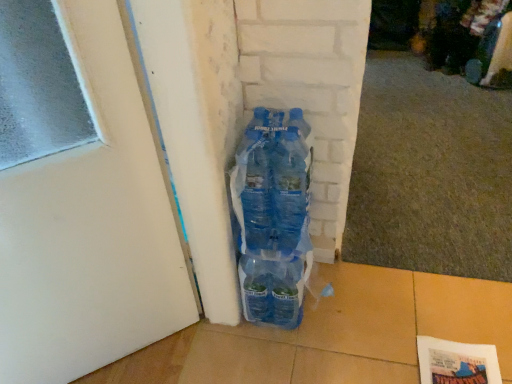
You are a GUI agent. You are given a task and a screenshot of the screen. Output one action in this format:
    pyautogui.click(x=<x>, y=<y>)
    Task: Click on the vacant area situated below translucent plastic bottles at center (from a real-world perspective)
    The image size is (512, 384).
    Given the screenshot: What is the action you would take?
    pyautogui.click(x=273, y=243)